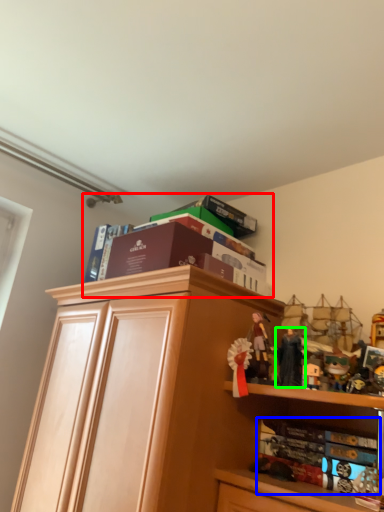
Question: Estimate the real-world distances between objects in this image. Which object is farther from book (highlighted by a red box), book (highlighted by a blue box) or toy (highlighted by a green box)?

Choices:
 (A) book
 (B) toy

Answer: (A)